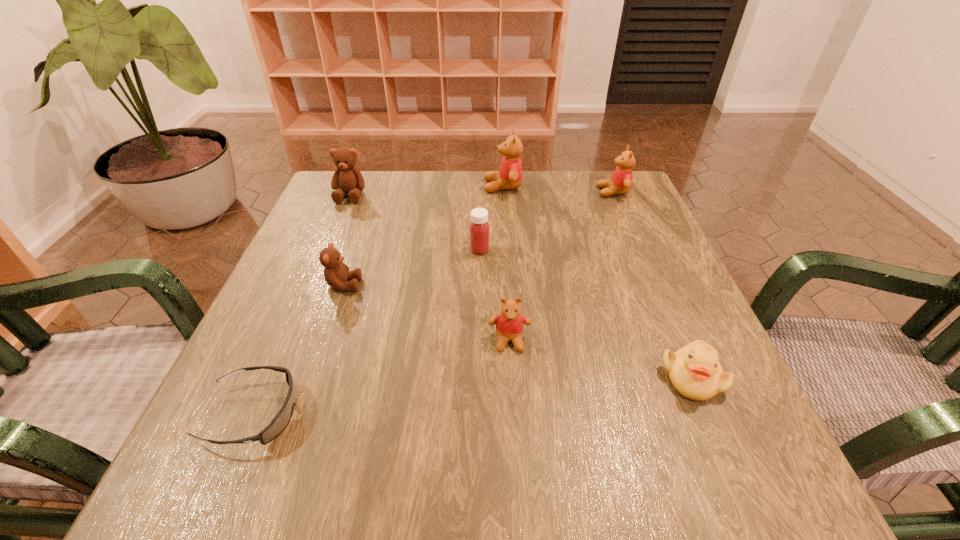
The width and height of the screenshot is (960, 540). In order to click on unoccupied area between the nearer brown teddy bear and the fourth farthest object in this screenshot , I will do `click(412, 267)`.

You are a GUI agent. You are given a task and a screenshot of the screen. Output one action in this format:
    pyautogui.click(x=<x>, y=<y>)
    Task: Click on the free point between the rightmost red teddy bear and the shortest object
    
    Given the screenshot: What is the action you would take?
    [x=433, y=303]

The width and height of the screenshot is (960, 540). Identify the location of free space between the duckling and the nearest teddy bear. (600, 359).

The height and width of the screenshot is (540, 960). I want to click on unoccupied position between the yellow duckling and the medicine, so click(586, 313).

This screenshot has height=540, width=960. What are the coordinates of `the fifth closest object to the medicine` in the screenshot? It's located at (x=621, y=180).

Locate which object is the fifth closest to the bigger brown teddy bear. Please provide its 2D coordinates. Your answer should be formatted as a tuple, i.e. [(x, y)], where the tuple contains the x and y coordinates of a point satisfying the conditions above.

[(281, 420)]

Select which teddy bear appears as the second closest to the second nearest teddy bear. Please provide its 2D coordinates. Your answer should be formatted as a tuple, i.e. [(x, y)], where the tuple contains the x and y coordinates of a point satisfying the conditions above.

[(509, 324)]

Find the location of `teddy bear that is the second closest to the duckling`. teddy bear that is the second closest to the duckling is located at coordinates (621, 180).

I want to click on red teddy bear that is the third closest one to the shortest object, so 621,180.

I want to click on red teddy bear that is the second closest to the red medicine, so click(x=509, y=324).